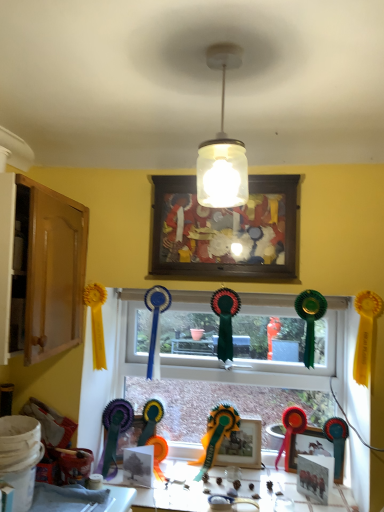
Question: Based on their positions, is white glossy table at lower center located to the left or right of matte green ribbon at center, which is the 1th toy in left-to-right order?

Choices:
 (A) right
 (B) left

Answer: (A)

Question: Would you say white glossy table at lower center is inside or outside matte green ribbon at center, which is the second toy from right to left?

Choices:
 (A) inside
 (B) outside

Answer: (B)

Question: Estimate the real-world distances between objects in this image. Which object is closer to the translucent glass jar at center?

Choices:
 (A) matte plastic picture frame at lower right, which is the 3th picture frame in front-to-back order
 (B) matte green ribbon at center, which is the second toy from right to left
 (C) wooden picture frame at center, the 4th picture frame in the bottom-to-top sequence
 (D) white glossy table at lower center
 (E) wooden cabinet at left

Answer: (C)

Question: Estimate the real-world distances between objects in this image. Which object is closer to the white glossy table at lower center?

Choices:
 (A) wooden cabinet at left
 (B) wooden photo frame at center, which ranks as the 4th picture frame in front-to-back order
 (C) translucent glass jar at center
 (D) shiny red ribbon at center, the second toy from the left
 (E) wooden picture frame at center, which is the first picture frame from front to back

Answer: (B)